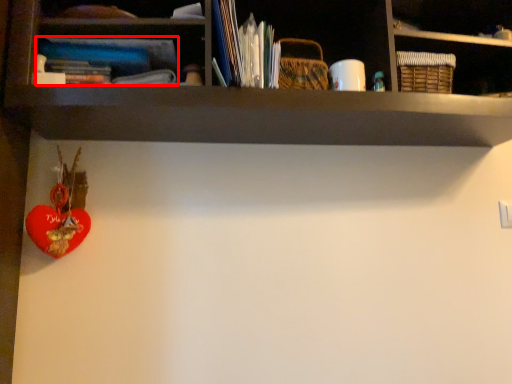
Question: From the image, what is the correct spatial relationship of book (annotated by the red box) in relation to toy?

Choices:
 (A) left
 (B) right

Answer: (B)